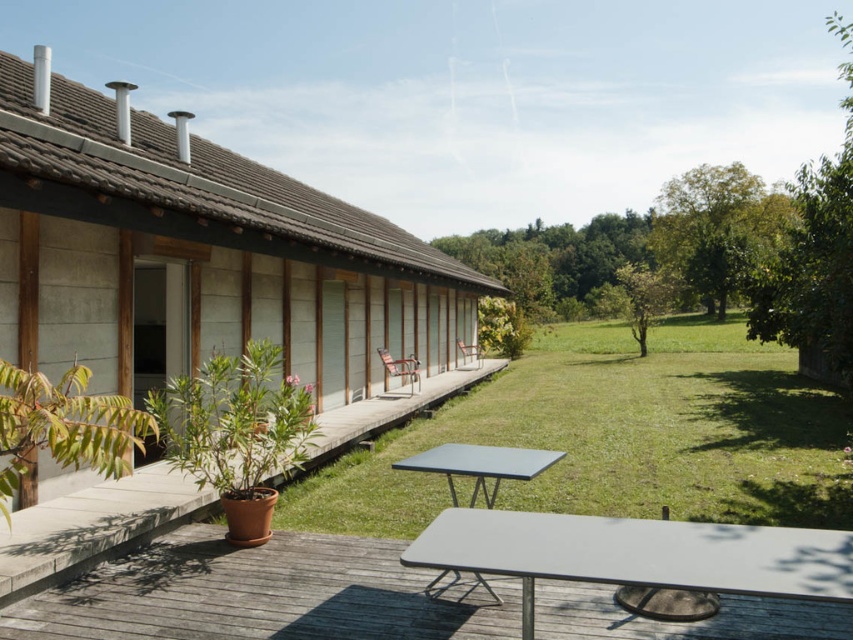
Question: Based on their relative distances, which object is nearer to the smooth gray table at lower center?

Choices:
 (A) metallic gray picnic table at center
 (B) brown wooden deck at lower left

Answer: (A)

Question: Which point is farther to the camera?

Choices:
 (A) metallic gray picnic table at center
 (B) green grass lawn at center

Answer: (B)

Question: Which object is closer to the camera taking this photo?

Choices:
 (A) smooth gray table at lower center
 (B) green grass lawn at center
 (C) brown wooden deck at lower left

Answer: (A)

Question: Is smooth gray table at lower center smaller than brown wooden deck at lower left?

Choices:
 (A) yes
 (B) no

Answer: (A)

Question: Is green grass lawn at center above smooth gray table at lower center?

Choices:
 (A) yes
 (B) no

Answer: (A)

Question: Does smooth gray table at lower center have a smaller size compared to brown wooden deck at lower left?

Choices:
 (A) yes
 (B) no

Answer: (A)